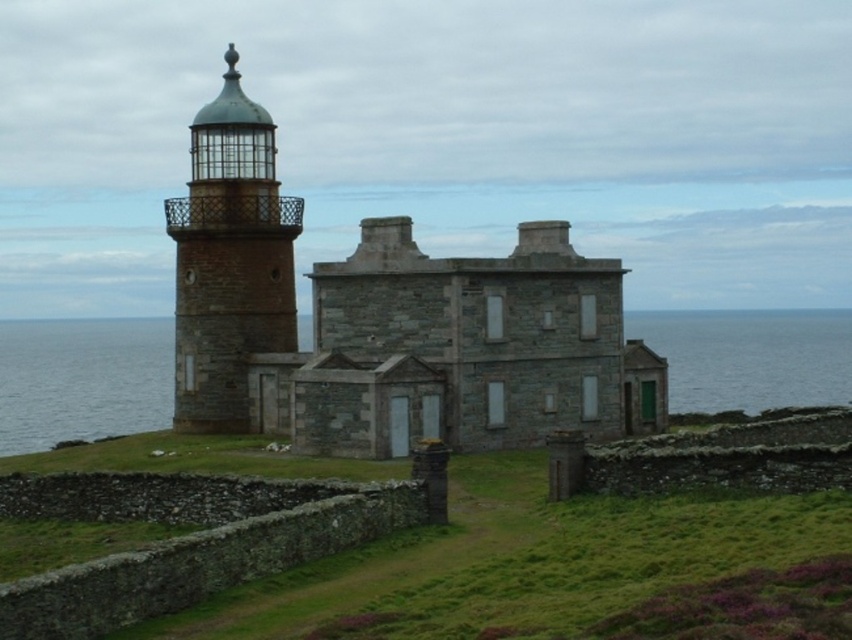
Which is in front, point (574, 317) or point (239, 205)?

Point (574, 317)

Is stone building at left wider than rustic stone lighthouse at left?

Yes.

Describe the element at coordinates (386, 323) in the screenshot. I see `stone building at left` at that location.

Find the location of a particular element. The height and width of the screenshot is (640, 852). stone building at left is located at coordinates click(x=386, y=323).

Which of these two, stone building at left or gray stone water at center, stands shorter?

With less height is gray stone water at center.

I want to click on stone building at left, so coord(386,323).

Is green grassy at center bigger than gray stone water at center?

Incorrect, green grassy at center is not larger than gray stone water at center.

Which is in front, point (804, 636) or point (41, 376)?

Point (804, 636) is more forward.

Between point (361, 584) and point (116, 417), which one is positioned behind?

Positioned behind is point (116, 417).

In order to click on green grassy at center in this screenshot , I will do `click(369, 548)`.